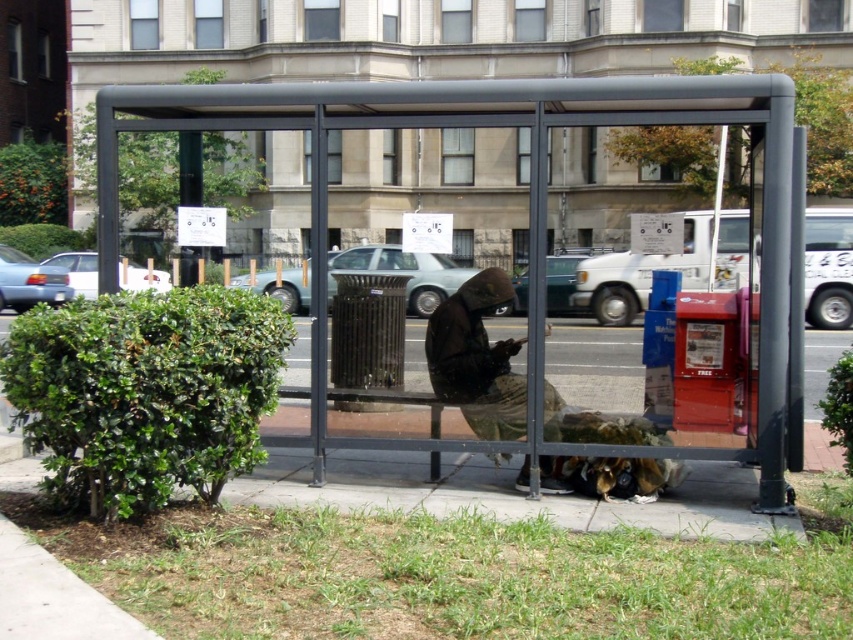
From the picture: You are a delivery person who needs to place a large package inside the matte black bus stop at center without blocking the camouflage fabric jacket at center. Is the bus stop large enough for both the package and the jacket?

The matte black bus stop at center is bigger than camouflage fabric jacket at center, so yes, the bus stop is large enough to accommodate both the package and the jacket without blocking the jacket.

You are a delivery person trying to place a large package in the matte black bus stop at center. Since the camouflage fabric jacket at center is occupying space there, can you move the package to the left side of the bus stop?

The matte black bus stop at center is positioned on the left side of camouflage fabric jacket at center, so the bus stop is already to the left of the jacket. Therefore, moving the package to the left side of the bus stop would place it further left, away from the jacket, making space available.

You are a delivery person who needs to place a package on top of the matte black bus stop at center. Can you do this without bending down, considering the height of the camouflage fabric jacket at center?

The matte black bus stop at center is taller than the camouflage fabric jacket at center, so you can place the package on top of the matte black bus stop at center without bending down since it is higher than the jacket.